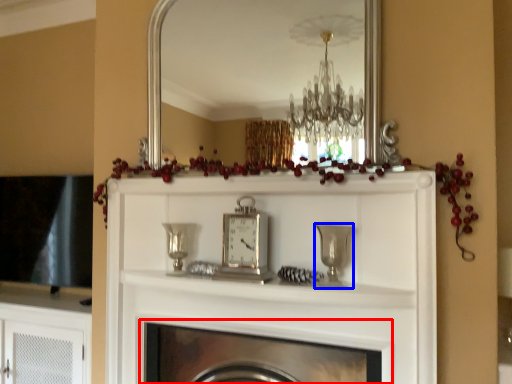
Question: Which of the following is the farthest to the observer, fireplace (highlighted by a red box) or candle holder (highlighted by a blue box)?

Choices:
 (A) fireplace
 (B) candle holder

Answer: (B)